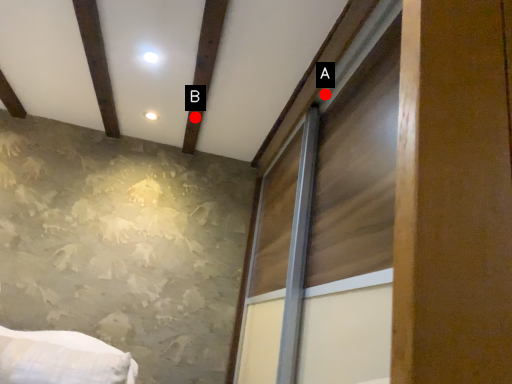
Question: Two points are circled on the image, labeled by A and B beside each circle. Among these points, which one is nearest to the camera?

Choices:
 (A) A is closer
 (B) B is closer

Answer: (A)